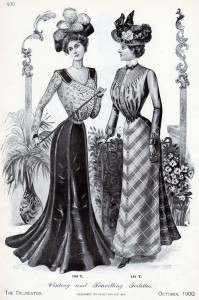
Where is `pillars`? The width and height of the screenshot is (199, 300). pillars is located at coordinates (29, 88), (182, 97).